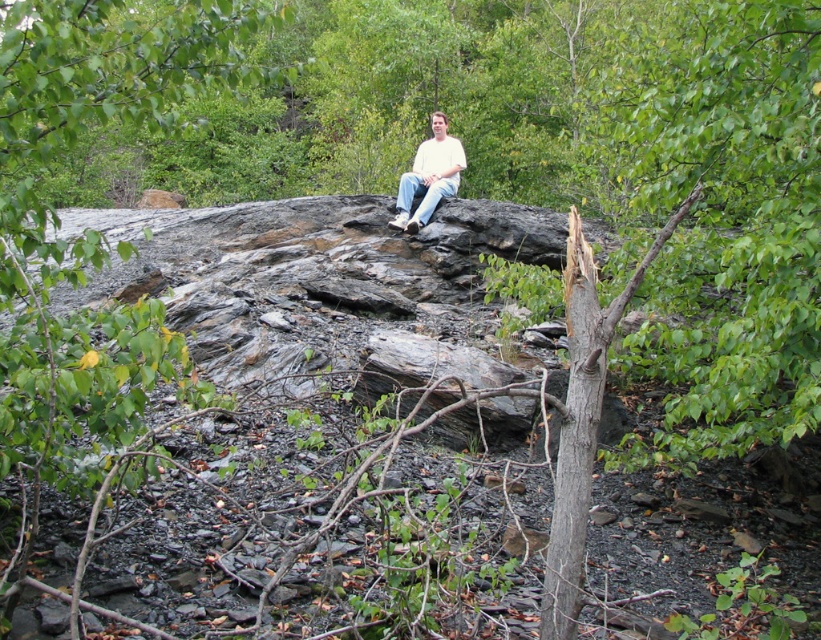
Question: Which of the following is the closest to the observer?

Choices:
 (A) gray rough bark tree trunk at right
 (B) white matte shirt at center

Answer: (A)

Question: Which point is closer to the camera taking this photo?

Choices:
 (A) coord(589,307)
 (B) coord(464,157)

Answer: (A)

Question: Which of the following is the farthest from the observer?

Choices:
 (A) (570, 401)
 (B) (437, 156)

Answer: (B)

Question: Is gray rough bark tree trunk at right positioned at the back of white matte shirt at center?

Choices:
 (A) no
 (B) yes

Answer: (A)

Question: Is gray rough bark tree trunk at right positioned before white matte shirt at center?

Choices:
 (A) no
 (B) yes

Answer: (B)

Question: Can you confirm if gray rough bark tree trunk at right is smaller than white matte shirt at center?

Choices:
 (A) no
 (B) yes

Answer: (B)